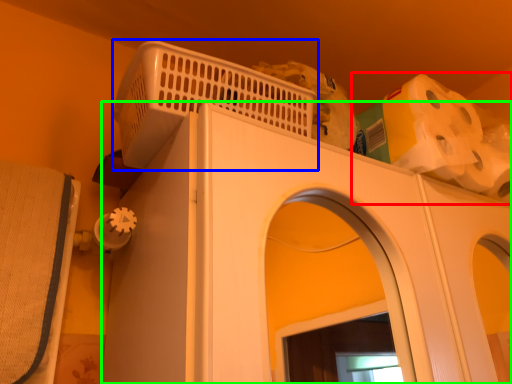
Question: Which object is the farthest from toilet paper (highlighted by a red box)? Choose among these: basket (highlighted by a blue box) or home appliance (highlighted by a green box).

Choices:
 (A) basket
 (B) home appliance

Answer: (A)